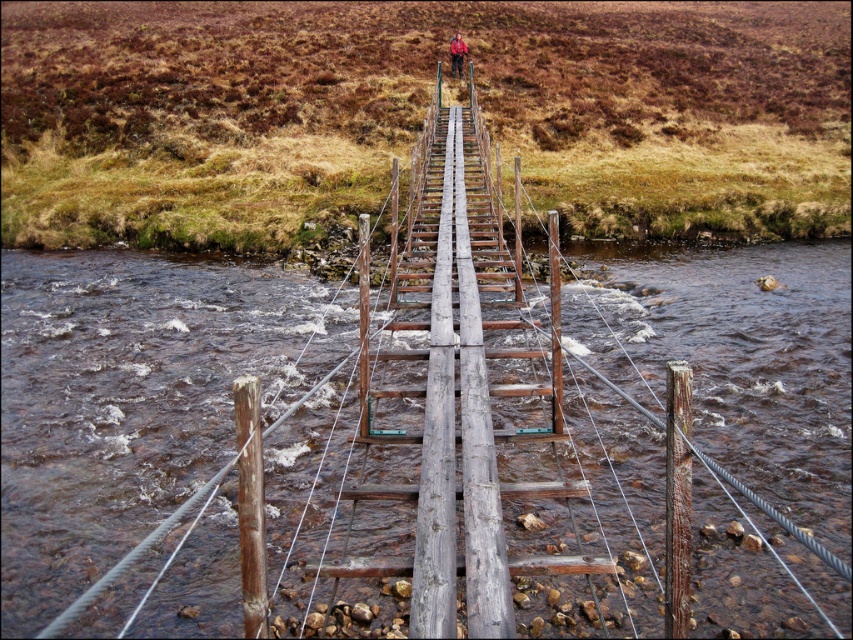
Question: Is brown wooden bridge at center behind red matte jacket at center?

Choices:
 (A) no
 (B) yes

Answer: (A)

Question: Among these objects, which one is farthest from the camera?

Choices:
 (A) red matte jacket at center
 (B) brown wooden bridge at center

Answer: (A)

Question: Does brown wooden bridge at center have a smaller size compared to red matte jacket at center?

Choices:
 (A) no
 (B) yes

Answer: (A)

Question: Can you confirm if brown wooden bridge at center is positioned to the right of red matte jacket at center?

Choices:
 (A) yes
 (B) no

Answer: (B)